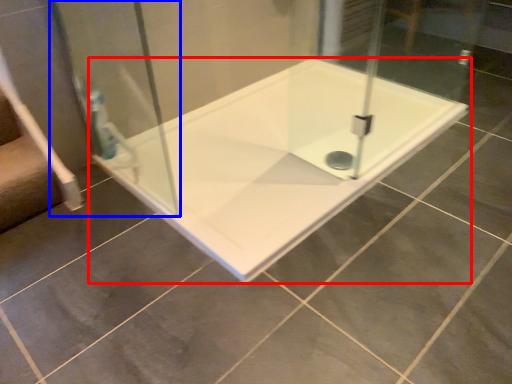
Question: Which object appears closest to the camera in this image, bathtub (highlighted by a red box) or shower door (highlighted by a blue box)?

Choices:
 (A) bathtub
 (B) shower door

Answer: (B)